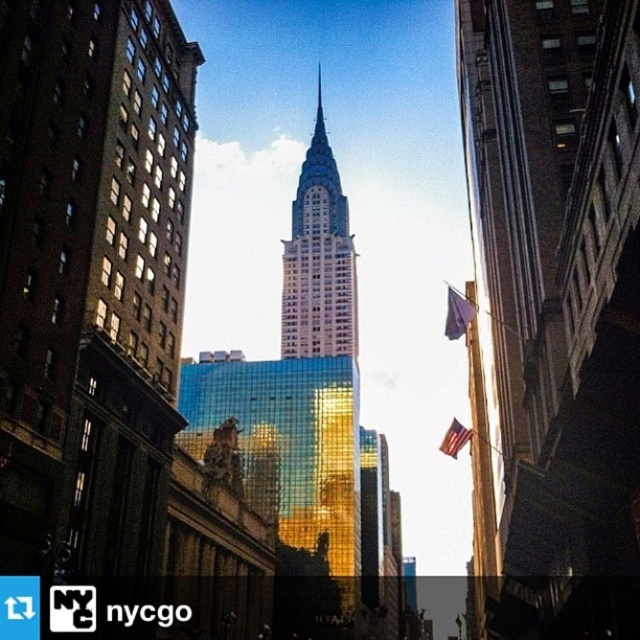
Question: Which of these objects is positioned farthest from the american flag at center?

Choices:
 (A) purple fabric flag at upper right
 (B) gold reflective glass skyscraper at center

Answer: (B)

Question: Can you confirm if gold reflective glass skyscraper at center is bigger than american flag at center?

Choices:
 (A) no
 (B) yes

Answer: (A)

Question: Which is nearer to the gold reflective glass skyscraper at center?

Choices:
 (A) american flag at center
 (B) purple fabric flag at upper right

Answer: (A)

Question: Where is gold reflective glass skyscraper at center located in relation to american flag at center in the image?

Choices:
 (A) below
 (B) above

Answer: (B)

Question: Is purple fabric flag at upper right positioned at the back of american flag at center?

Choices:
 (A) no
 (B) yes

Answer: (A)

Question: Among these objects, which one is farthest from the camera?

Choices:
 (A) american flag at center
 (B) gold reflective glass skyscraper at center

Answer: (B)